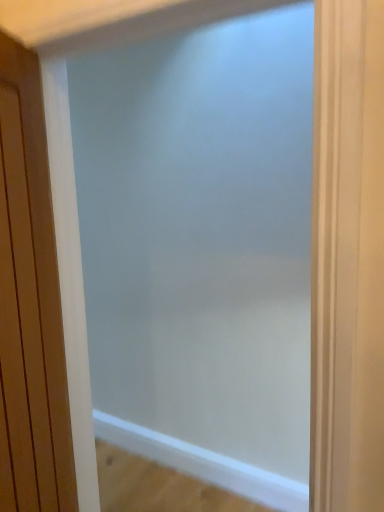
Question: Does frosted glass screen door at center have a larger size compared to wooden door at left?

Choices:
 (A) no
 (B) yes

Answer: (B)

Question: Is frosted glass screen door at center positioned with its back to wooden door at left?

Choices:
 (A) no
 (B) yes

Answer: (B)

Question: Considering the relative sizes of frosted glass screen door at center and wooden door at left in the image provided, is frosted glass screen door at center smaller than wooden door at left?

Choices:
 (A) yes
 (B) no

Answer: (B)

Question: Is frosted glass screen door at center outside wooden door at left?

Choices:
 (A) no
 (B) yes

Answer: (B)

Question: Can you confirm if frosted glass screen door at center is taller than wooden door at left?

Choices:
 (A) no
 (B) yes

Answer: (B)

Question: Does frosted glass screen door at center have a lesser width compared to wooden door at left?

Choices:
 (A) no
 (B) yes

Answer: (A)

Question: Is wooden door at left facing away from frosted glass screen door at center?

Choices:
 (A) no
 (B) yes

Answer: (B)

Question: From a real-world perspective, is wooden door at left beneath frosted glass screen door at center?

Choices:
 (A) no
 (B) yes

Answer: (A)

Question: From the image's perspective, would you say wooden door at left is shown under frosted glass screen door at center?

Choices:
 (A) yes
 (B) no

Answer: (B)

Question: From the image's perspective, is wooden door at left located above frosted glass screen door at center?

Choices:
 (A) yes
 (B) no

Answer: (A)

Question: Is wooden door at left wider than frosted glass screen door at center?

Choices:
 (A) no
 (B) yes

Answer: (A)

Question: Could you tell me if wooden door at left is facing frosted glass screen door at center?

Choices:
 (A) yes
 (B) no

Answer: (A)

Question: From their relative heights in the image, would you say wooden door at left is taller or shorter than frosted glass screen door at center?

Choices:
 (A) tall
 (B) short

Answer: (B)